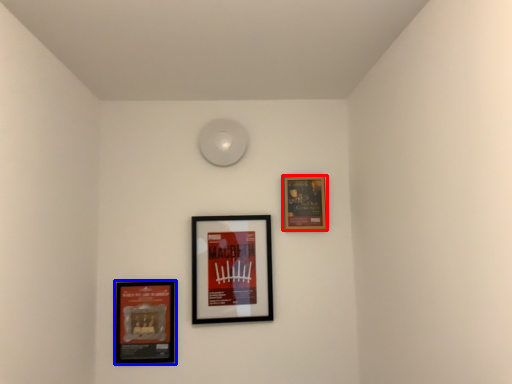
Question: Which object is further to the camera taking this photo, picture frame (highlighted by a red box) or picture frame (highlighted by a blue box)?

Choices:
 (A) picture frame
 (B) picture frame

Answer: (A)